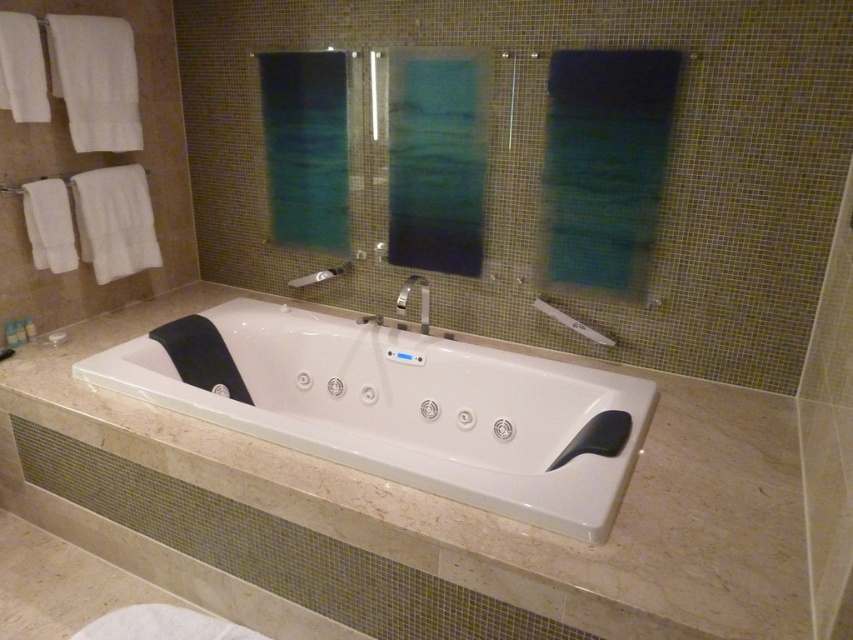
Question: Is silver metallic towel bar at upper center thinner than matte silver showerhead at center?

Choices:
 (A) no
 (B) yes

Answer: (B)

Question: Which of the following is the farthest from the observer?

Choices:
 (A) (433, 371)
 (B) (317, 272)

Answer: (B)

Question: Does white glossy bathtub at center have a smaller size compared to matte silver showerhead at center?

Choices:
 (A) no
 (B) yes

Answer: (A)

Question: Can you confirm if white glossy bathtub at center is wider than silver metallic towel bar at upper center?

Choices:
 (A) no
 (B) yes

Answer: (B)

Question: Which object appears closest to the camera in this image?

Choices:
 (A) matte silver showerhead at center
 (B) white glossy bathtub at center

Answer: (B)

Question: Which of the following is the farthest from the observer?

Choices:
 (A) matte silver showerhead at center
 (B) white glossy bathtub at center

Answer: (A)